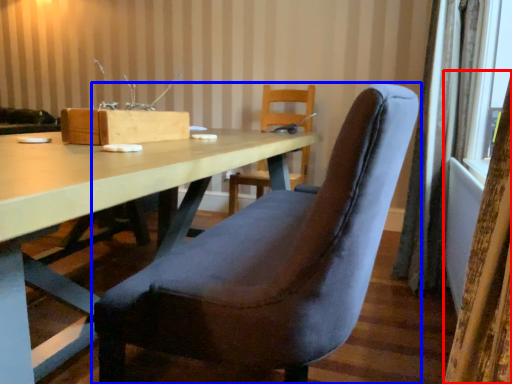
Question: Which of the following is the closest to the observer, curtain (highlighted by a red box) or chair (highlighted by a blue box)?

Choices:
 (A) curtain
 (B) chair

Answer: (A)